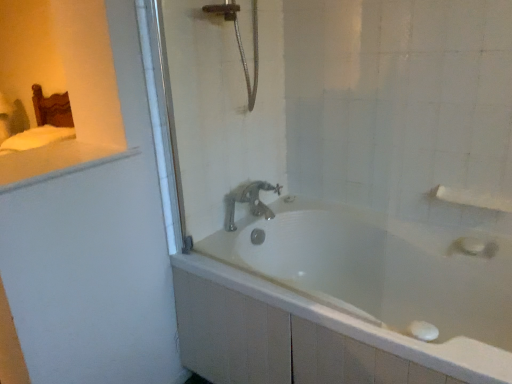
Question: Should I look upward or downward to see white matte towel bar at upper right?

Choices:
 (A) down
 (B) up

Answer: (A)

Question: Considering the relative sizes of white glossy bathtub at center and white glossy counter top at upper left in the image provided, is white glossy bathtub at center smaller than white glossy counter top at upper left?

Choices:
 (A) no
 (B) yes

Answer: (A)

Question: Is the depth of white glossy bathtub at center greater than that of white glossy counter top at upper left?

Choices:
 (A) yes
 (B) no

Answer: (B)

Question: Is white glossy bathtub at center not inside white glossy counter top at upper left?

Choices:
 (A) yes
 (B) no

Answer: (A)

Question: From the image's perspective, would you say white glossy bathtub at center is shown under white glossy counter top at upper left?

Choices:
 (A) no
 (B) yes

Answer: (B)

Question: Could white glossy counter top at upper left be considered to be inside white glossy bathtub at center?

Choices:
 (A) yes
 (B) no

Answer: (B)

Question: Does white glossy bathtub at center touch white glossy counter top at upper left?

Choices:
 (A) yes
 (B) no

Answer: (B)

Question: From a real-world perspective, does polished chrome faucet at center stand above white glossy bathtub at center?

Choices:
 (A) yes
 (B) no

Answer: (A)

Question: Is white glossy bathtub at center surrounded by polished chrome faucet at center?

Choices:
 (A) no
 (B) yes

Answer: (A)

Question: Can you confirm if polished chrome faucet at center is bigger than white glossy bathtub at center?

Choices:
 (A) yes
 (B) no

Answer: (B)

Question: Considering the relative sizes of polished chrome faucet at center and white glossy bathtub at center in the image provided, is polished chrome faucet at center smaller than white glossy bathtub at center?

Choices:
 (A) yes
 (B) no

Answer: (A)

Question: Considering the relative positions of polished chrome faucet at center and white glossy bathtub at center in the image provided, is polished chrome faucet at center to the left of white glossy bathtub at center from the viewer's perspective?

Choices:
 (A) no
 (B) yes

Answer: (B)

Question: From a real-world perspective, is polished chrome faucet at center beneath white glossy bathtub at center?

Choices:
 (A) no
 (B) yes

Answer: (A)

Question: Is white matte towel bar at upper right wider than white glossy counter top at upper left?

Choices:
 (A) no
 (B) yes

Answer: (A)